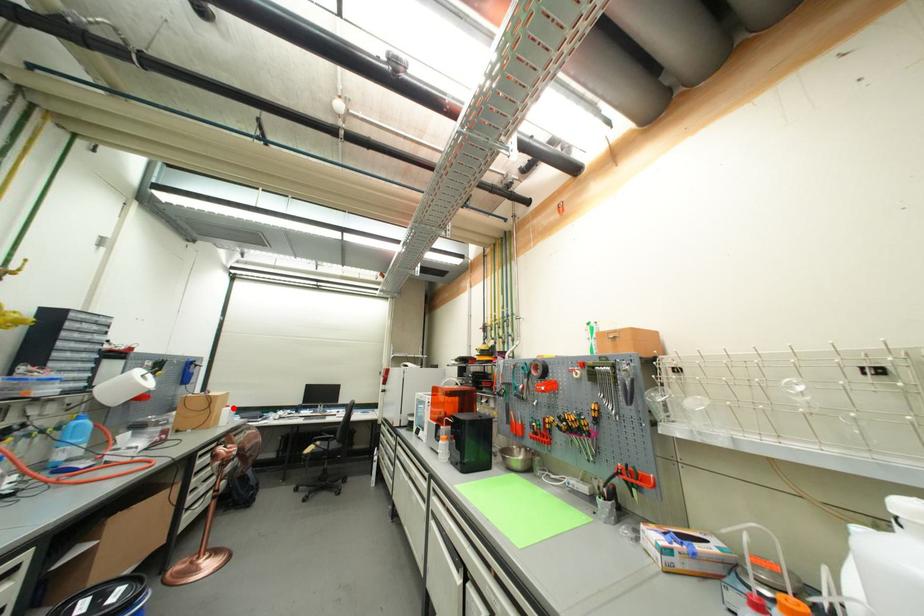
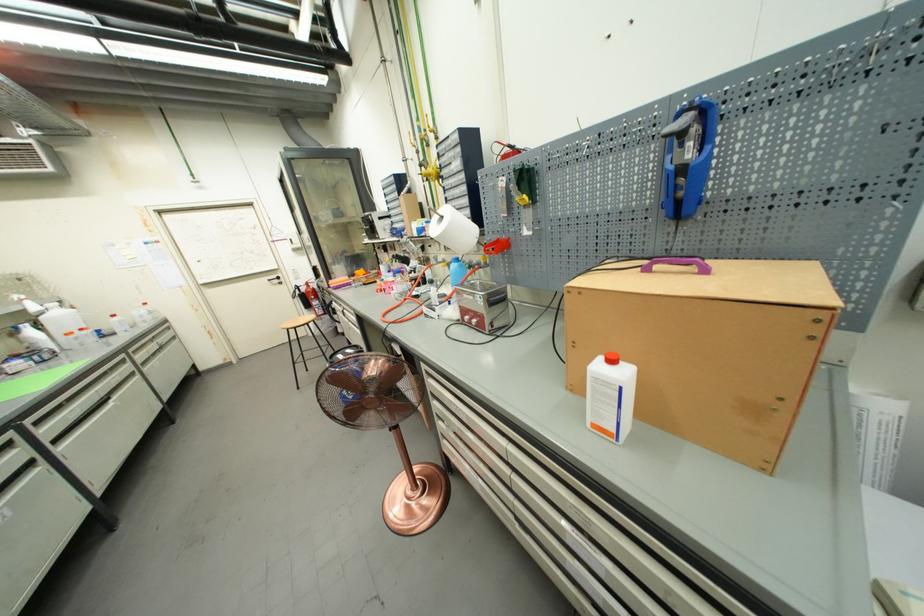
The point at the highlighted location is marked in the first image. Where is the corresponding point in the second image?

(617, 363)